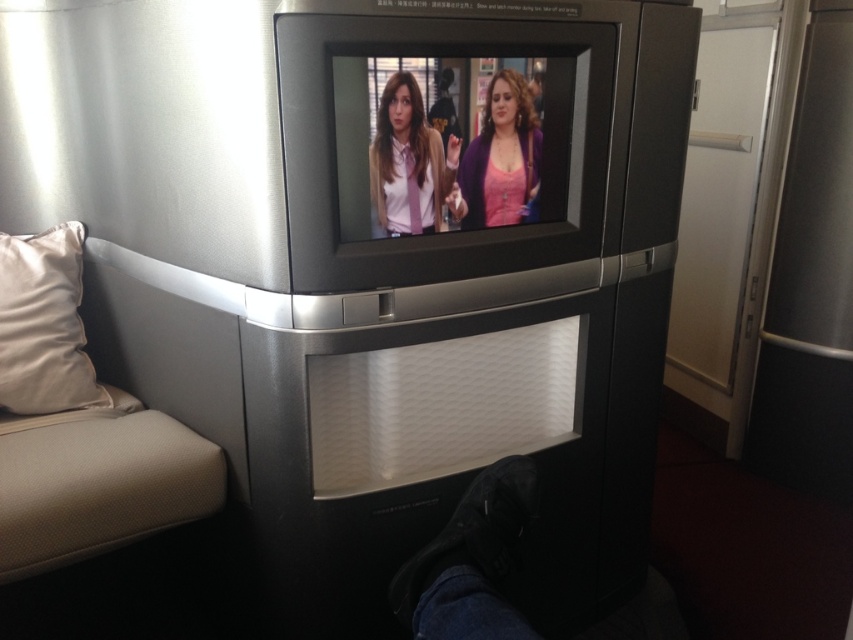
You are sitting in the seat to the left of the television screen. You want to reach the point at coordinates point (33,333). Your arm can extend 4 feet. Can you reach it?

The distance between you and the point at coordinates point (33,333) is 4.59 feet, which is slightly longer than your arm can reach. You cannot reach it.

You are a fashion designer observing the matte pink tie at center and the pink matte sweater at center on the TV screen. You need to determine if there is enough space between them to insert a 10 cm wide accessory. Can you fit it?

The distance between the matte pink tie at center and the pink matte sweater at center is 9.23 centimeters, which is less than 10 cm. Therefore, the accessory cannot fit between them.